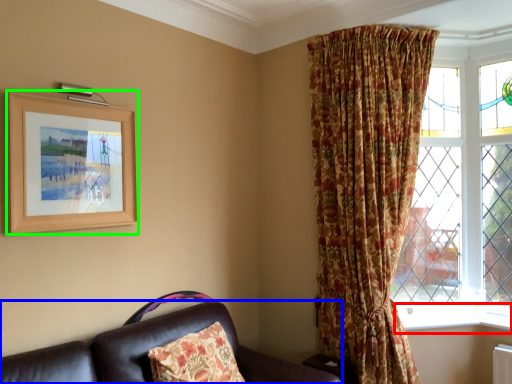
Question: Which object is the closest to the window sill (highlighted by a red box)? Choose among these: studio couch (highlighted by a blue box) or picture frame (highlighted by a green box).

Choices:
 (A) studio couch
 (B) picture frame

Answer: (A)